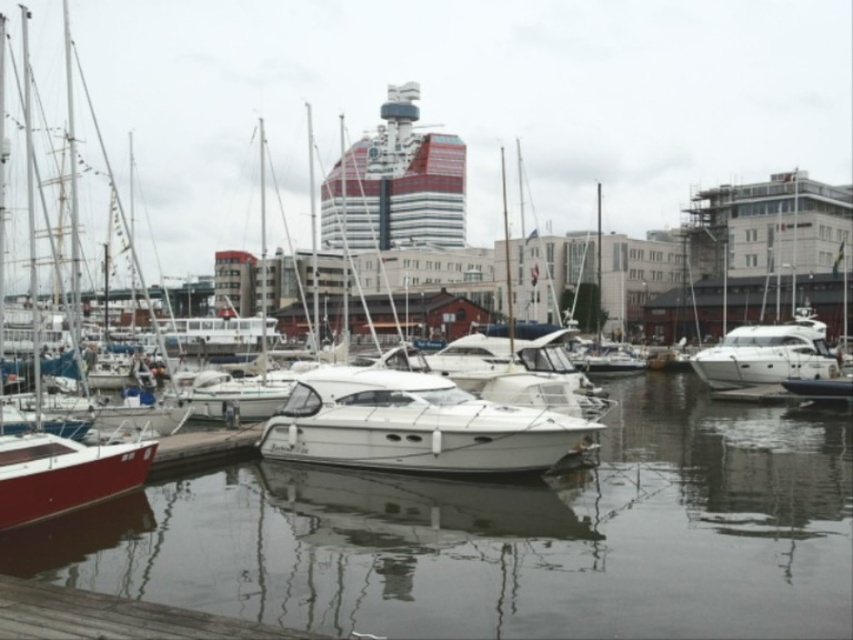
Question: Is wooden at lower left wider than white glossy yacht at right?

Choices:
 (A) yes
 (B) no

Answer: (B)

Question: Which point is farther from the camera taking this photo?

Choices:
 (A) (791, 440)
 (B) (311, 636)
 (C) (408, 392)

Answer: (A)

Question: Which object is positioned farthest from the red and white glass cruise ship at center?

Choices:
 (A) glossy water at center
 (B) wooden at lower left

Answer: (B)

Question: Is white glossy boat at center thinner than white glossy yacht at right?

Choices:
 (A) no
 (B) yes

Answer: (B)

Question: Among these points, which one is nearest to the camera?

Choices:
 (A) (756, 342)
 (B) (329, 227)
 (C) (682, 500)

Answer: (C)

Question: Is red and white glass cruise ship at center to the left of white glossy yacht at right from the viewer's perspective?

Choices:
 (A) yes
 (B) no

Answer: (A)